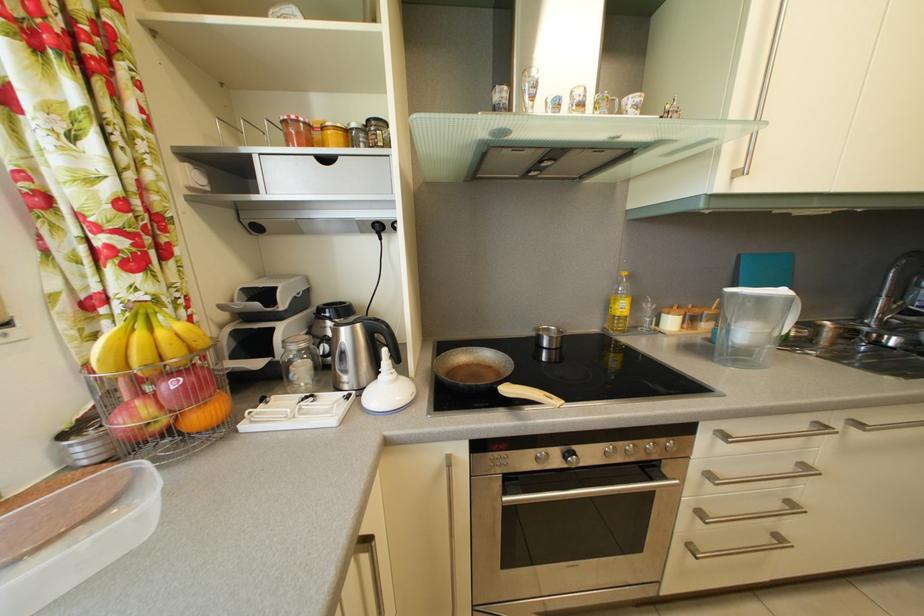
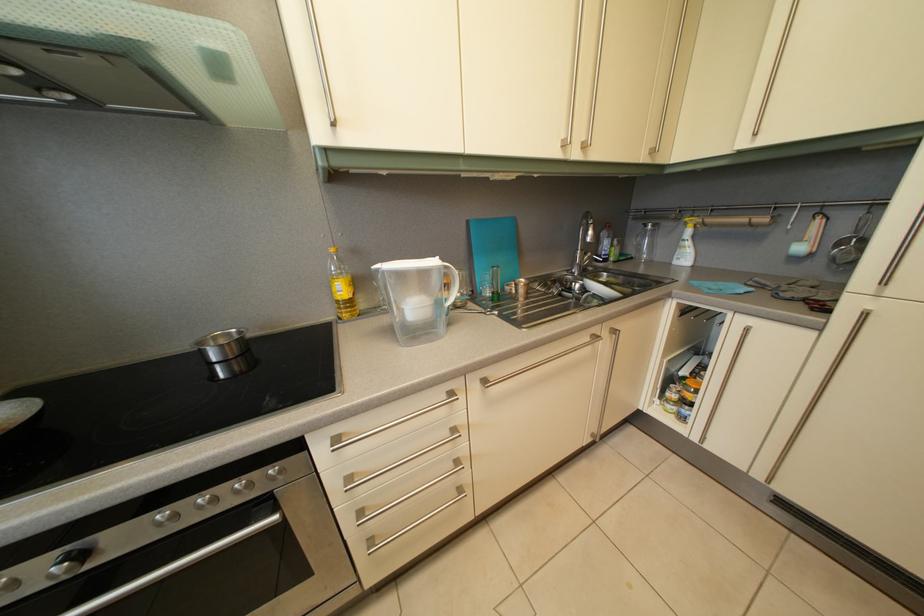
Question: The camera is either moving clockwise (left) or counter-clockwise (right) around the object. The first image is from the beginning of the video and the second image is from the end. Is the camera moving left or right when shooting the video?

Choices:
 (A) Left
 (B) Right

Answer: (A)